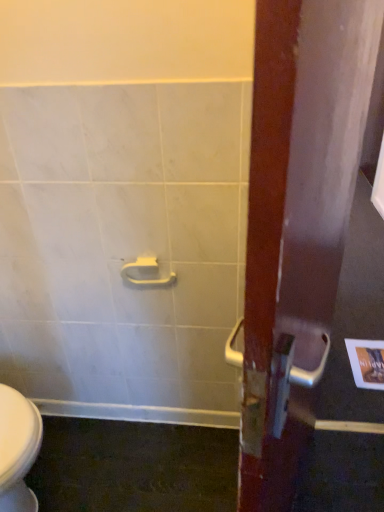
Where is `wooden door handle at center`? The image size is (384, 512). wooden door handle at center is located at coordinates pos(298,223).

In order to face wooden door handle at center, should I rotate leftwards or rightwards?

You should look right and rotate roughly 15.362 degrees.

What do you see at coordinates (298, 223) in the screenshot? I see `wooden door handle at center` at bounding box center [298, 223].

Where is `wooden door handle at center`? wooden door handle at center is located at coordinates (298, 223).